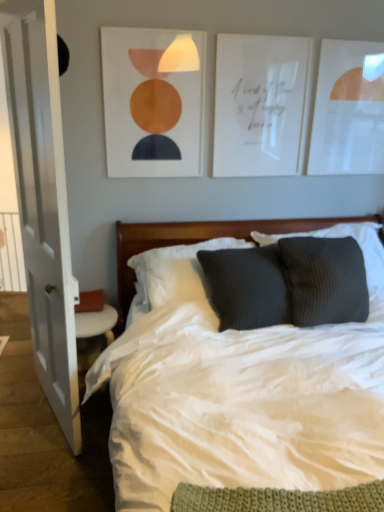
Question: Should I look upward or downward to see wooden headboard at center?

Choices:
 (A) down
 (B) up

Answer: (A)

Question: From the image's perspective, would you say white wood door at left is shown under white plastic radiator at left?

Choices:
 (A) no
 (B) yes

Answer: (A)

Question: From a real-world perspective, does white wood door at left stand above white plastic radiator at left?

Choices:
 (A) yes
 (B) no

Answer: (A)

Question: Is the position of white wood door at left less distant than that of white plastic radiator at left?

Choices:
 (A) yes
 (B) no

Answer: (A)

Question: Can you confirm if white wood door at left is thinner than white plastic radiator at left?

Choices:
 (A) yes
 (B) no

Answer: (B)

Question: Is white wood door at left surrounding white plastic radiator at left?

Choices:
 (A) yes
 (B) no

Answer: (B)

Question: Can you confirm if white wood door at left is smaller than white plastic radiator at left?

Choices:
 (A) no
 (B) yes

Answer: (A)

Question: Considering the relative positions of white wood door at left and white paper picture frame at upper right, the first picture frame positioned from the right, in the image provided, is white wood door at left to the left of white paper picture frame at upper right, the first picture frame positioned from the right, from the viewer's perspective?

Choices:
 (A) yes
 (B) no

Answer: (A)

Question: From a real-world perspective, is white wood door at left located beneath white paper picture frame at upper right, the first picture frame positioned from the right?

Choices:
 (A) no
 (B) yes

Answer: (B)

Question: From a real-world perspective, is white wood door at left located higher than white paper picture frame at upper right, the 3th picture frame when ordered from left to right?

Choices:
 (A) no
 (B) yes

Answer: (A)

Question: Can you see white wood door at left touching white paper picture frame at upper right, the first picture frame positioned from the right?

Choices:
 (A) no
 (B) yes

Answer: (A)

Question: Is white wood door at left smaller than white paper picture frame at upper right, the 3th picture frame when ordered from left to right?

Choices:
 (A) no
 (B) yes

Answer: (A)

Question: Does white wood door at left have a greater width compared to white paper picture frame at upper right, the first picture frame positioned from the right?

Choices:
 (A) yes
 (B) no

Answer: (A)

Question: Is white paper picture frame at upper center, arranged as the second picture frame when viewed from the left, completely or partially outside of matte orange circle at upper center, which is the third picture frame in right-to-left order?

Choices:
 (A) yes
 (B) no

Answer: (A)